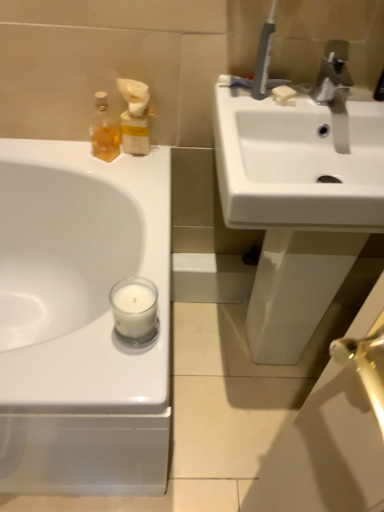
Where is `free spot in front of white matte glass candle at lower center`? free spot in front of white matte glass candle at lower center is located at coordinates (113, 367).